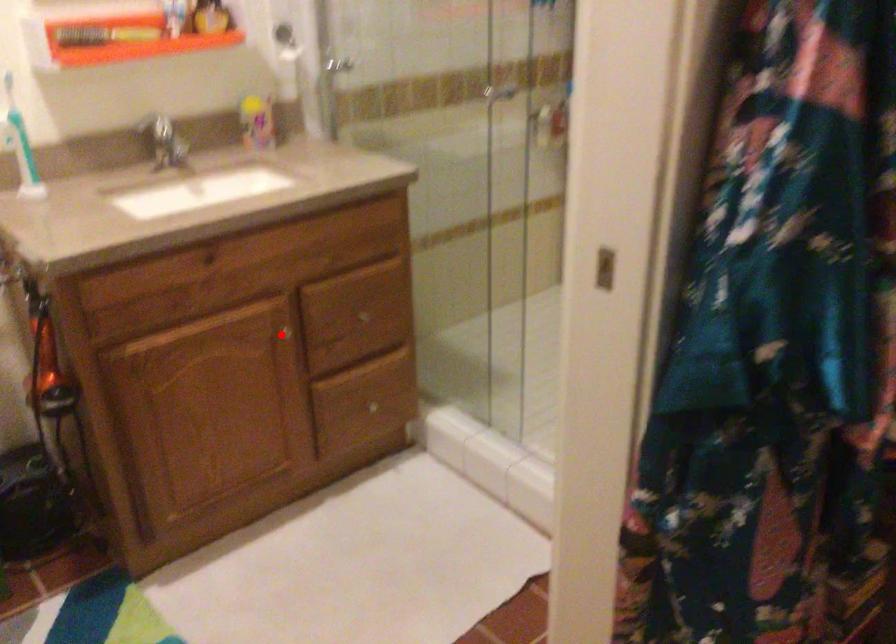
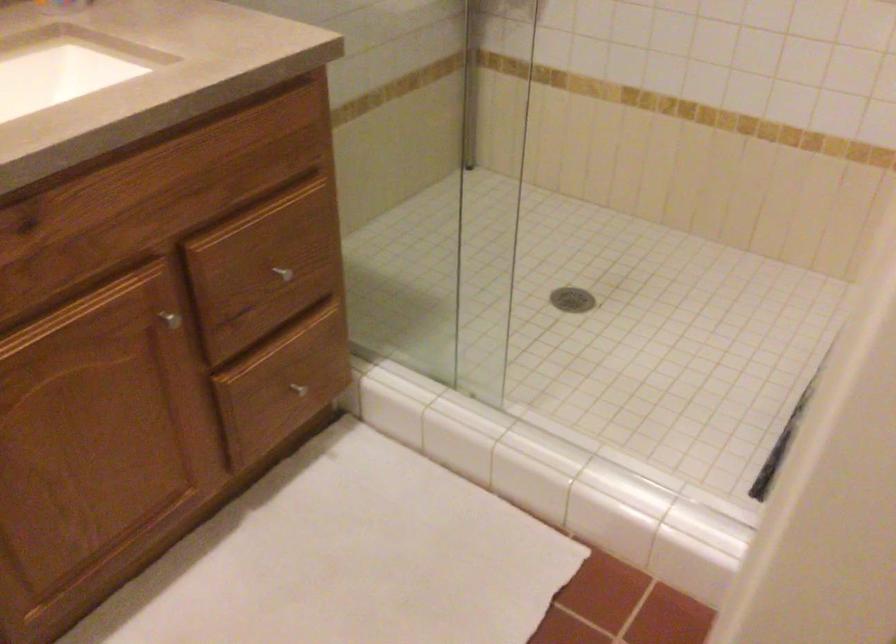
Find the pixel in the second image that matches the highlighted location in the first image.

(169, 319)